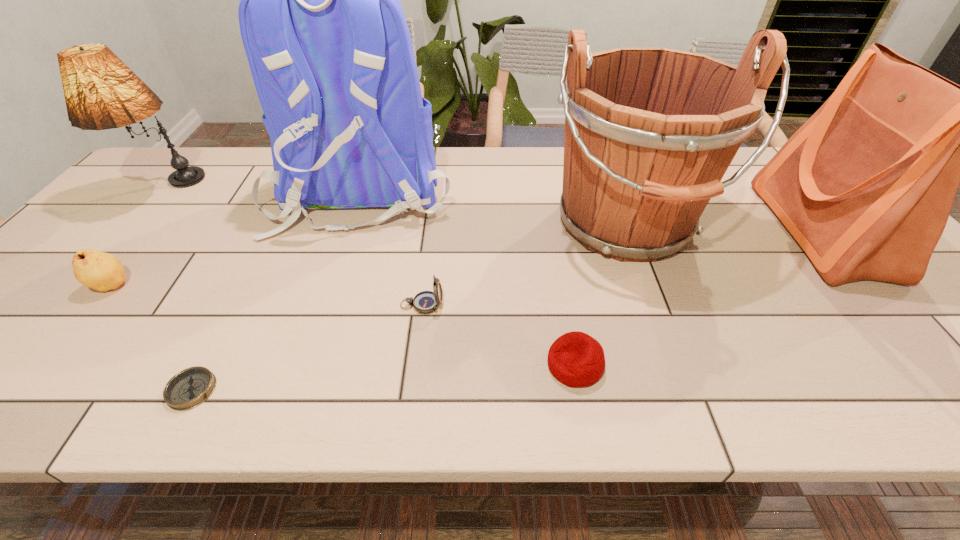
Locate an element on the screen. the tallest object is located at coordinates (x=329, y=49).

Image resolution: width=960 pixels, height=540 pixels. What are the coordinates of `bucket` in the screenshot? It's located at (649, 132).

At what (x,y) coordinates should I click in order to perform the action: click on the rightmost object. Please return your answer as a coordinate pair (x, y). This screenshot has width=960, height=540. Looking at the image, I should click on tap(865, 186).

Identify the location of lampshade. The height and width of the screenshot is (540, 960). (101, 92).

Find the location of `the fourth shortest object`. the fourth shortest object is located at coordinates (101, 271).

Locate an element on the screen. The image size is (960, 540). the farther compass is located at coordinates (425, 302).

The height and width of the screenshot is (540, 960). Identify the location of the third shortest object. (425, 302).

The width and height of the screenshot is (960, 540). I want to click on beanbag, so coord(575,359).

In order to click on the shortest object in this screenshot , I will do `click(189, 388)`.

This screenshot has height=540, width=960. Identify the location of the nearer compass. (x=189, y=388).